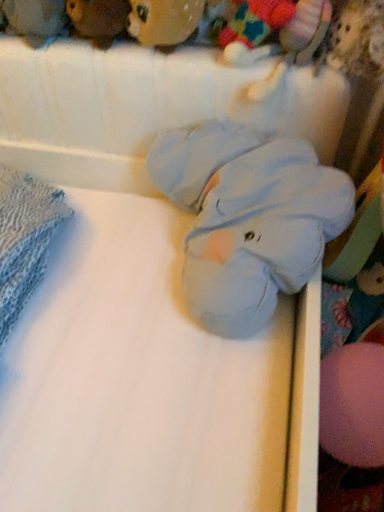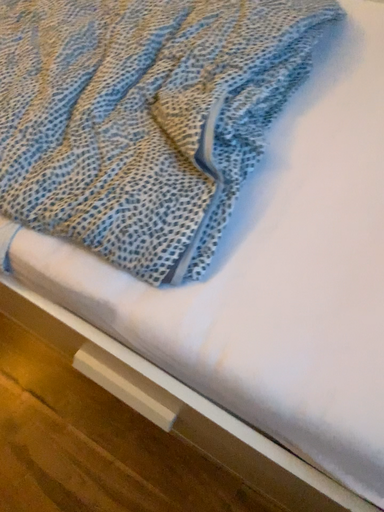
Question: Which way did the camera rotate in the video?

Choices:
 (A) rotated right
 (B) rotated left

Answer: (B)